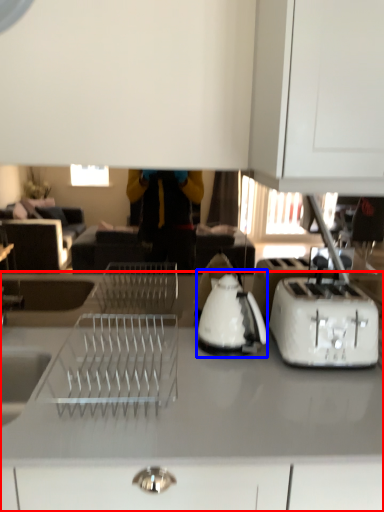
Question: Which of the following is the closest to the observer, countertop (highlighted by a red box) or kettle (highlighted by a blue box)?

Choices:
 (A) countertop
 (B) kettle

Answer: (A)